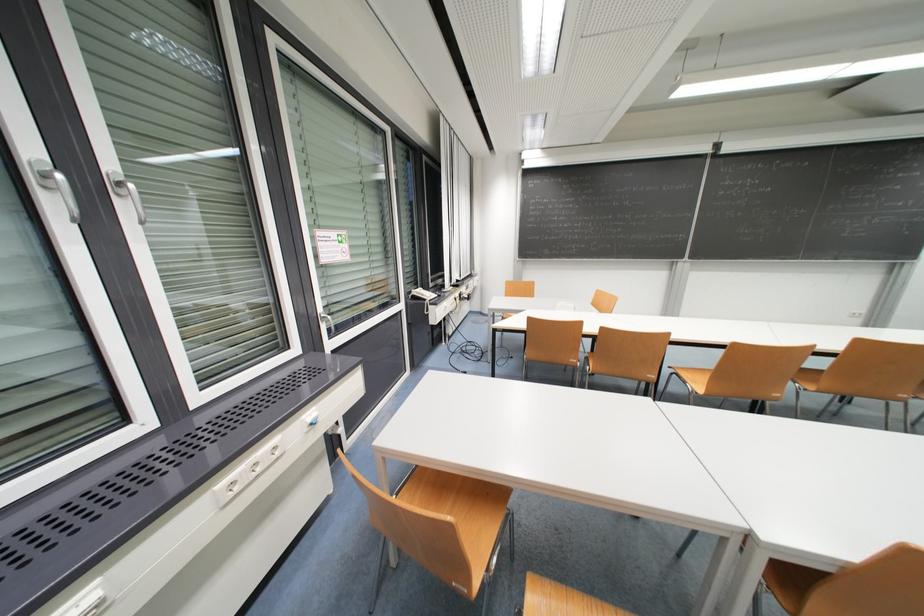
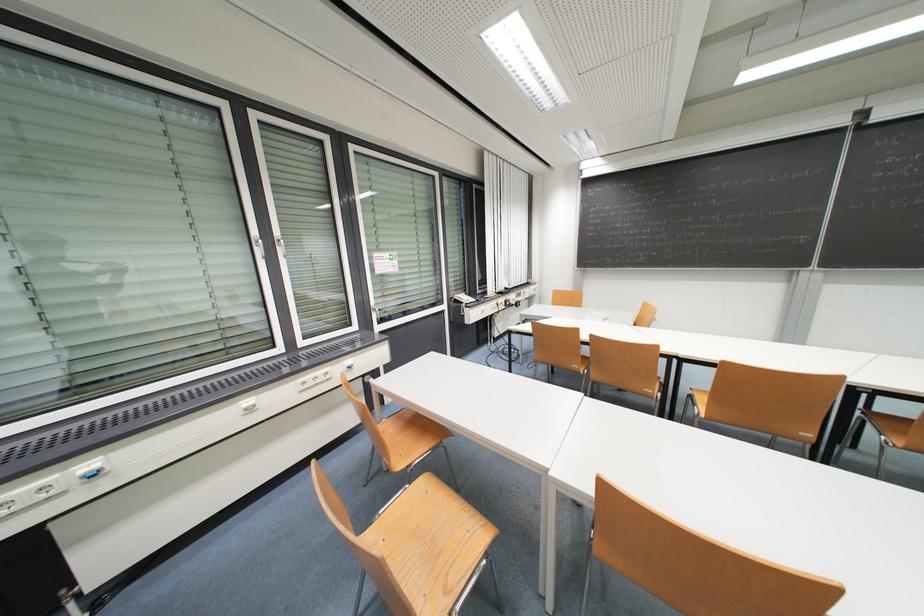
Which direction would the cameraman need to move to produce the second image?

The cameraman moved toward right, backward.